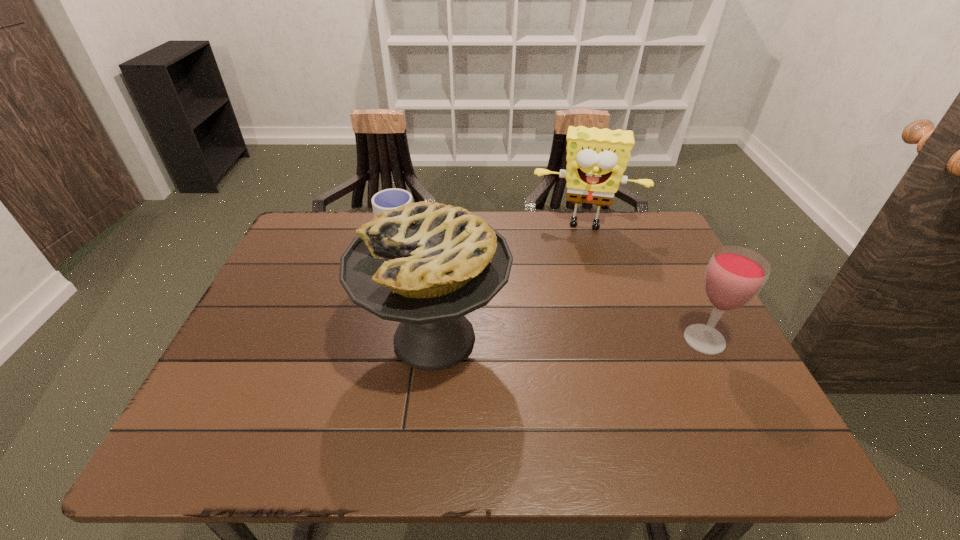
Where is `free space on the desktop that is between the pie and the second shortest object and is positioned with the handle on the side of the cup`? free space on the desktop that is between the pie and the second shortest object and is positioned with the handle on the side of the cup is located at coordinates (543, 339).

This screenshot has width=960, height=540. Identify the location of vacant space on the desktop that is between the pie and the second shortest object and is positioned on the front-facing side of the sponge. (578, 339).